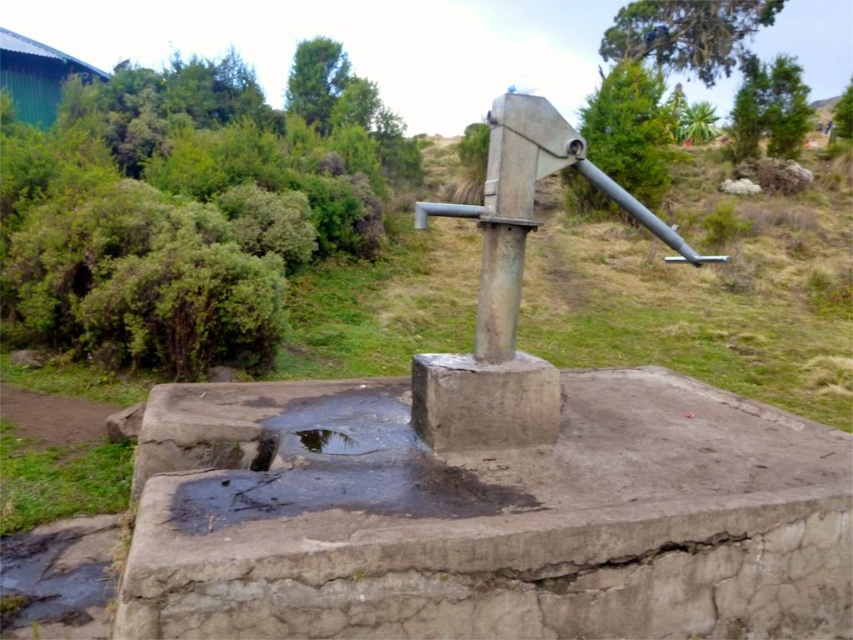
Question: Is gray concrete basin at center positioned behind black glossy puddle at center?

Choices:
 (A) no
 (B) yes

Answer: (A)

Question: Which point is closer to the camera?

Choices:
 (A) gray concrete basin at center
 (B) black glossy puddle at center

Answer: (A)

Question: Does gray concrete basin at center have a smaller size compared to black glossy puddle at center?

Choices:
 (A) no
 (B) yes

Answer: (A)

Question: Is the position of gray concrete basin at center less distant than that of black glossy puddle at center?

Choices:
 (A) no
 (B) yes

Answer: (B)